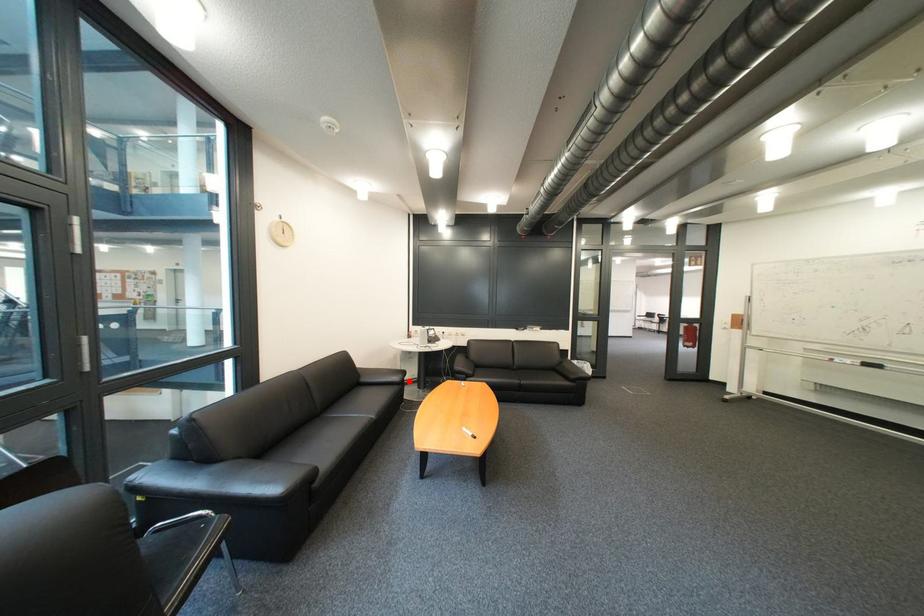
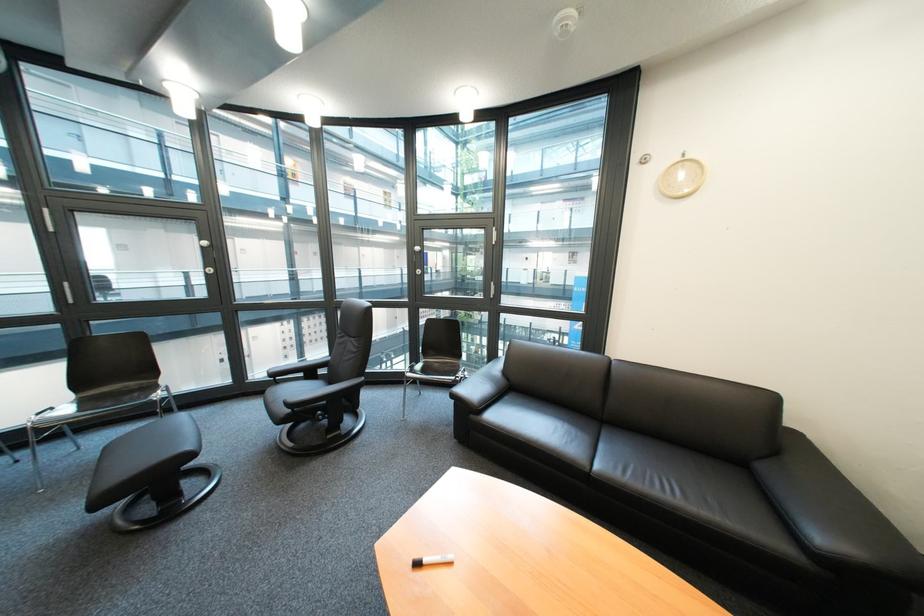
Question: I am providing you with two images of the same scene from different viewpoints. In image1, a red point is highlighted. Considering the same 3D point in image2, which of the following is correct?

Choices:
 (A) It is closer
 (B) It is farther

Answer: (A)